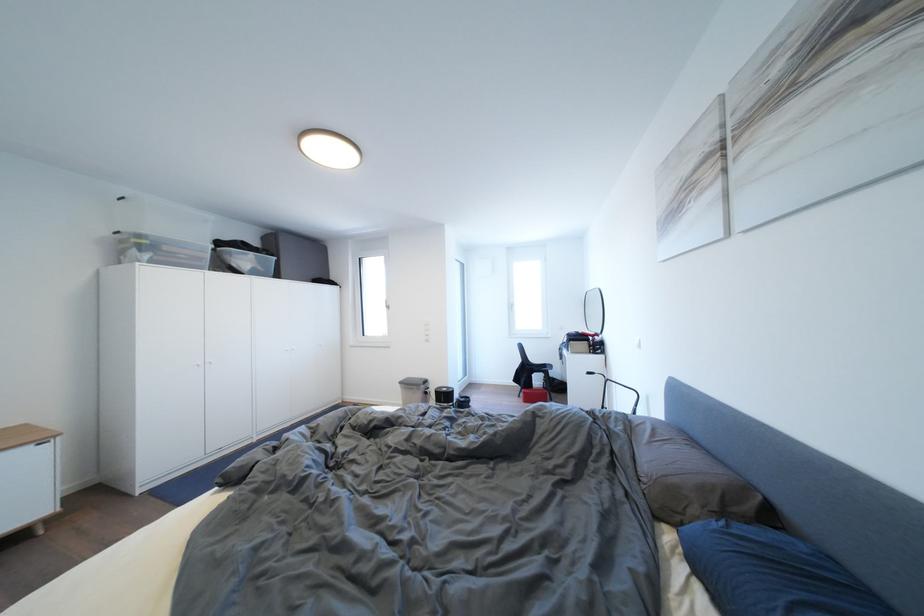
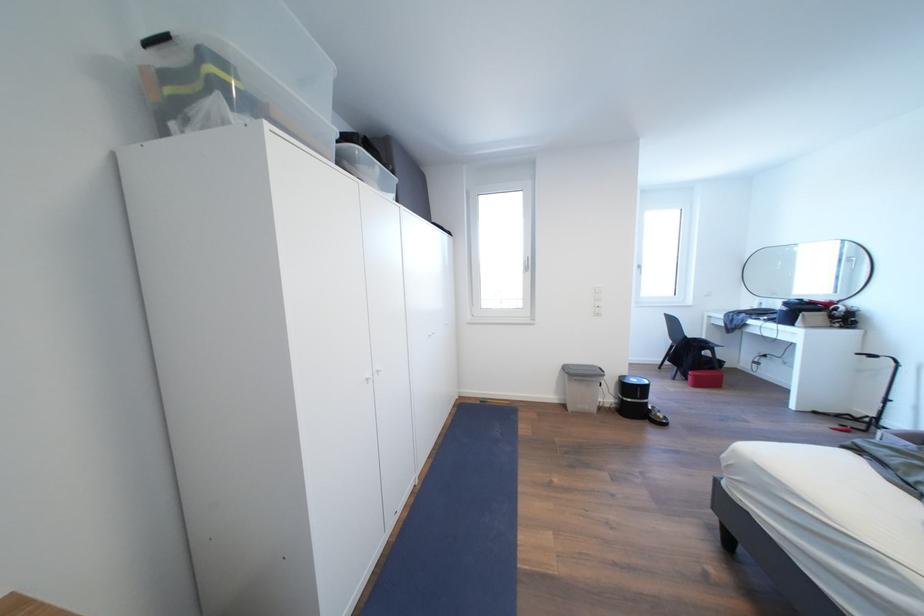
What movement of the cameraman would produce the second image?

The cameraman moved toward left, forward.